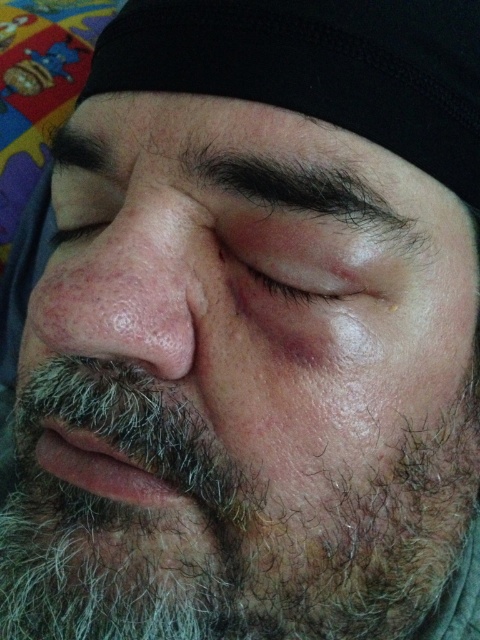
Does pink matte nose at center appear over dry skin at center?

Indeed, pink matte nose at center is positioned over dry skin at center.

Does pink matte nose at center have a lesser height compared to dry skin at center?

In fact, pink matte nose at center may be taller than dry skin at center.

I want to click on pink matte nose at center, so click(x=120, y=273).

Is point (336, 536) farther from viewer compared to point (325, 282)?

Yes, it is.

Does gray/woolly beard at lower left have a lesser height compared to dry skin at center?

Incorrect, gray/woolly beard at lower left's height does not fall short of dry skin at center's.

Between point (381, 573) and point (262, 289), which one is positioned behind?

Point (381, 573)

Where is `gray/woolly beard at lower left`? gray/woolly beard at lower left is located at coordinates (218, 516).

Does dark brown hair at upper center appear on the right side of matte skin at left?

Yes, dark brown hair at upper center is to the right of matte skin at left.

Is dark brown hair at upper center above matte skin at left?

Indeed, dark brown hair at upper center is positioned over matte skin at left.

The width and height of the screenshot is (480, 640). I want to click on dark brown hair at upper center, so click(x=243, y=156).

I want to click on dark brown hair at upper center, so click(243, 156).